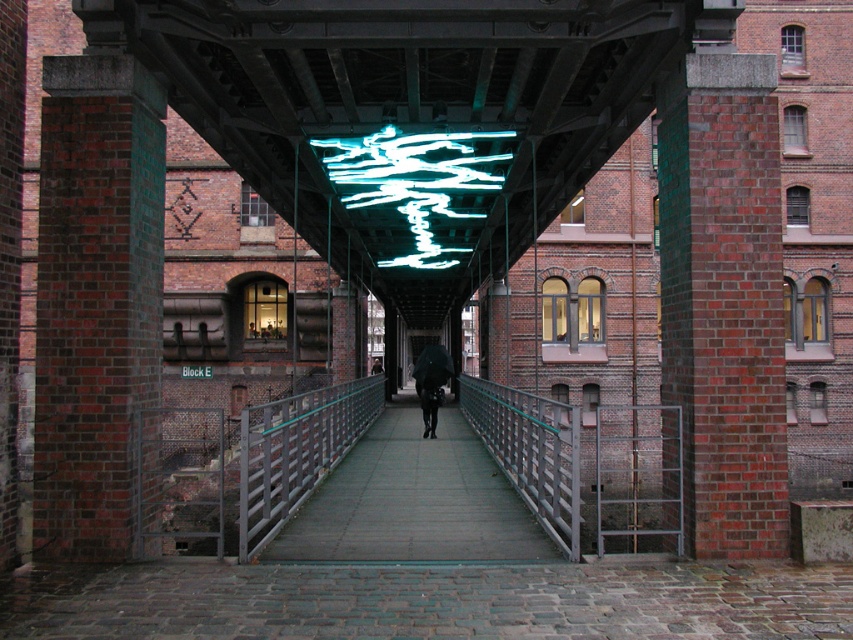
Who is lower down, smooth concrete walkway at center or neon green glass at center?

smooth concrete walkway at center is below.

Is smooth concrete walkway at center to the left of neon green glass at center from the viewer's perspective?

No, smooth concrete walkway at center is not to the left of neon green glass at center.

Where is `smooth concrete walkway at center`? This screenshot has width=853, height=640. smooth concrete walkway at center is located at coordinates (496, 451).

Image resolution: width=853 pixels, height=640 pixels. Find the location of `smooth concrete walkway at center`. smooth concrete walkway at center is located at coordinates (496, 451).

Does translucent glass ceiling at center appear under neon green glass at center?

Indeed, translucent glass ceiling at center is positioned under neon green glass at center.

Does translucent glass ceiling at center have a larger size compared to neon green glass at center?

Yes.

Find the location of a particular element. translucent glass ceiling at center is located at coordinates (412, 115).

In the scene shown: Does translucent glass ceiling at center have a lesser width compared to smooth concrete walkway at center?

Yes.

Between point (442, 35) and point (483, 467), which one is positioned in front?

Point (442, 35)

Find the location of `translucent glass ceiling at center`. translucent glass ceiling at center is located at coordinates (412, 115).